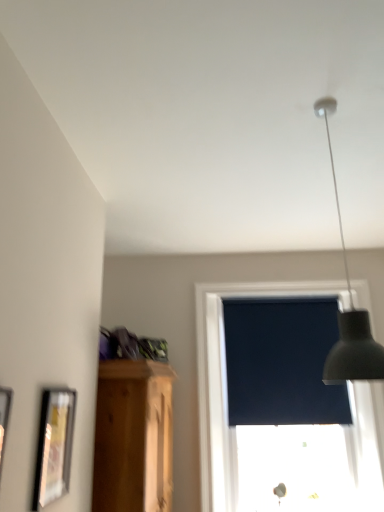
Question: Would you say dark matte window screen at center is outside matte black picture frame at lower left, the 1th picture frame viewed from the back?

Choices:
 (A) yes
 (B) no

Answer: (A)

Question: From a real-world perspective, does dark matte window screen at center sit lower than matte black picture frame at lower left, the 2th picture frame from the front?

Choices:
 (A) yes
 (B) no

Answer: (B)

Question: From the image's perspective, is dark matte window screen at center over matte black picture frame at lower left, the 2th picture frame from the front?

Choices:
 (A) yes
 (B) no

Answer: (B)

Question: Is dark matte window screen at center behind matte black picture frame at lower left, the 1th picture frame viewed from the back?

Choices:
 (A) no
 (B) yes

Answer: (B)

Question: Does dark matte window screen at center have a lesser height compared to matte black picture frame at lower left, the 2th picture frame from the front?

Choices:
 (A) yes
 (B) no

Answer: (B)

Question: Looking at the image, does wooden picture frame at left, the first picture frame when ordered from front to back, seem bigger or smaller compared to dark matte window screen at center?

Choices:
 (A) small
 (B) big

Answer: (A)

Question: Considering the positions of wooden picture frame at left, the 2th picture frame in the back-to-front sequence, and dark matte window screen at center in the image, is wooden picture frame at left, the 2th picture frame in the back-to-front sequence, wider or thinner than dark matte window screen at center?

Choices:
 (A) wide
 (B) thin

Answer: (B)

Question: In the image, is wooden picture frame at left, the 2th picture frame in the back-to-front sequence, positioned in front of or behind dark matte window screen at center?

Choices:
 (A) front
 (B) behind

Answer: (A)

Question: Do you think wooden picture frame at left, the 2th picture frame in the back-to-front sequence, is within dark matte window screen at center, or outside of it?

Choices:
 (A) outside
 (B) inside

Answer: (A)

Question: Is point (56, 475) closer or farther from the camera than point (4, 390)?

Choices:
 (A) closer
 (B) farther

Answer: (B)

Question: In terms of height, does matte black picture frame at lower left, the 2th picture frame from the front, look taller or shorter compared to wooden picture frame at left, the 2th picture frame in the back-to-front sequence?

Choices:
 (A) tall
 (B) short

Answer: (A)

Question: In terms of width, does matte black picture frame at lower left, the 1th picture frame viewed from the back, look wider or thinner when compared to wooden picture frame at left, the first picture frame when ordered from front to back?

Choices:
 (A) thin
 (B) wide

Answer: (B)

Question: From the image's perspective, is matte black picture frame at lower left, the 2th picture frame from the front, above or below wooden picture frame at left, the first picture frame when ordered from front to back?

Choices:
 (A) above
 (B) below

Answer: (B)

Question: Relative to wooden picture frame at left, the first picture frame when ordered from front to back, is matte black lampshade at upper right in front or behind?

Choices:
 (A) behind
 (B) front

Answer: (A)

Question: Looking at their shapes, would you say matte black lampshade at upper right is wider or thinner than wooden picture frame at left, the 2th picture frame in the back-to-front sequence?

Choices:
 (A) thin
 (B) wide

Answer: (B)